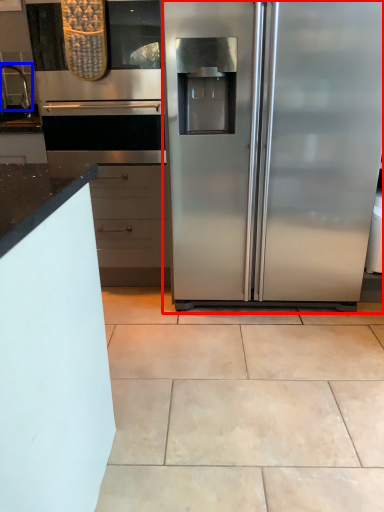
Question: Among these objects, which one is farthest to the camera, refrigerator (highlighted by a red box) or faucet (highlighted by a blue box)?

Choices:
 (A) refrigerator
 (B) faucet

Answer: (B)